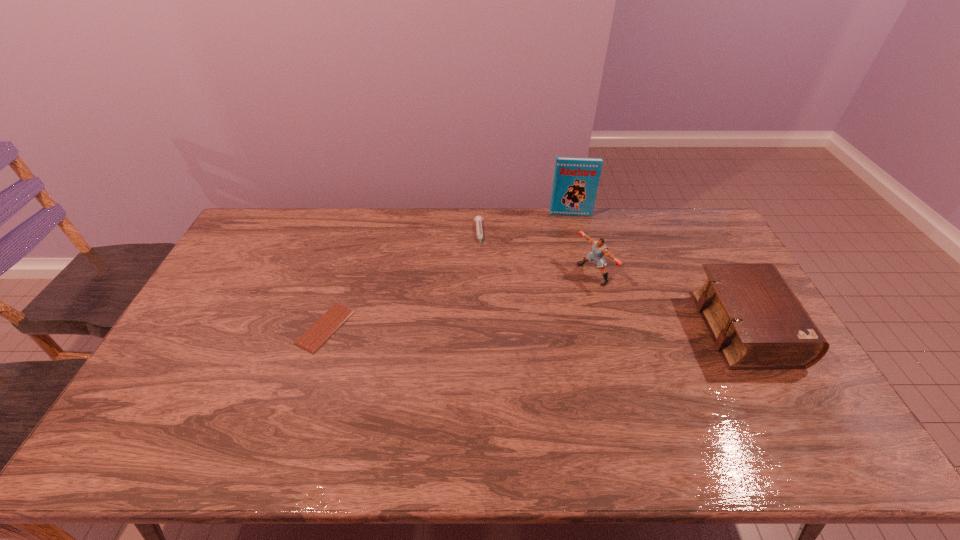
Where is `the leftmost object`? the leftmost object is located at coordinates (335, 317).

Identify the location of the shortest object. This screenshot has width=960, height=540. (335, 317).

This screenshot has width=960, height=540. Find the location of `Bible`. Bible is located at coordinates (x=756, y=321).

The height and width of the screenshot is (540, 960). Identify the location of the third tallest object. (756, 321).

The width and height of the screenshot is (960, 540). I want to click on the third nearest object, so click(599, 249).

Locate an element on the screen. This screenshot has height=540, width=960. the fourth object from right to left is located at coordinates (478, 219).

At what (x,y) coordinates should I click in order to perform the action: click on syringe. Please return your answer as a coordinate pair (x, y). Looking at the image, I should click on (478, 219).

The height and width of the screenshot is (540, 960). What are the coordinates of `the farthest object` in the screenshot? It's located at (576, 179).

Find the location of `the tallest object`. the tallest object is located at coordinates (576, 179).

Where is `free point located 0.060m on the front of the chocolate bar`? The width and height of the screenshot is (960, 540). free point located 0.060m on the front of the chocolate bar is located at coordinates (311, 372).